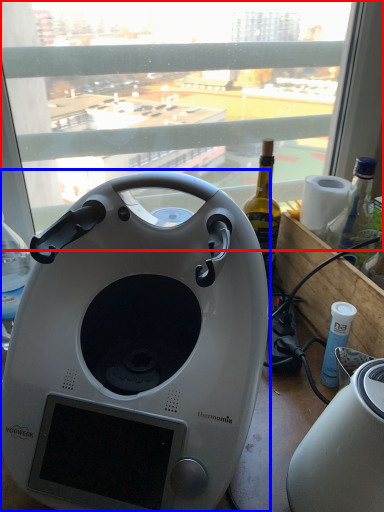
Question: Among these objects, which one is farthest to the camera, window (highlighted by a red box) or home appliance (highlighted by a blue box)?

Choices:
 (A) window
 (B) home appliance

Answer: (A)